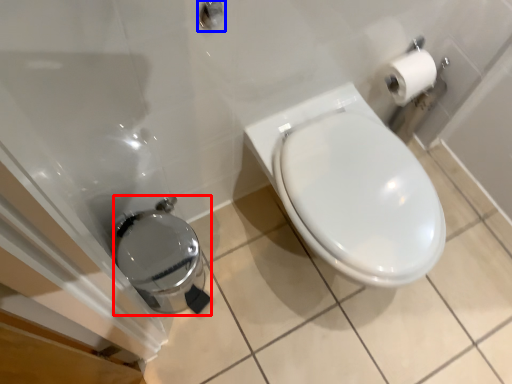
Question: Among these objects, which one is nearest to the camera, porcelain (highlighted by a red box) or shower (highlighted by a blue box)?

Choices:
 (A) porcelain
 (B) shower

Answer: (B)